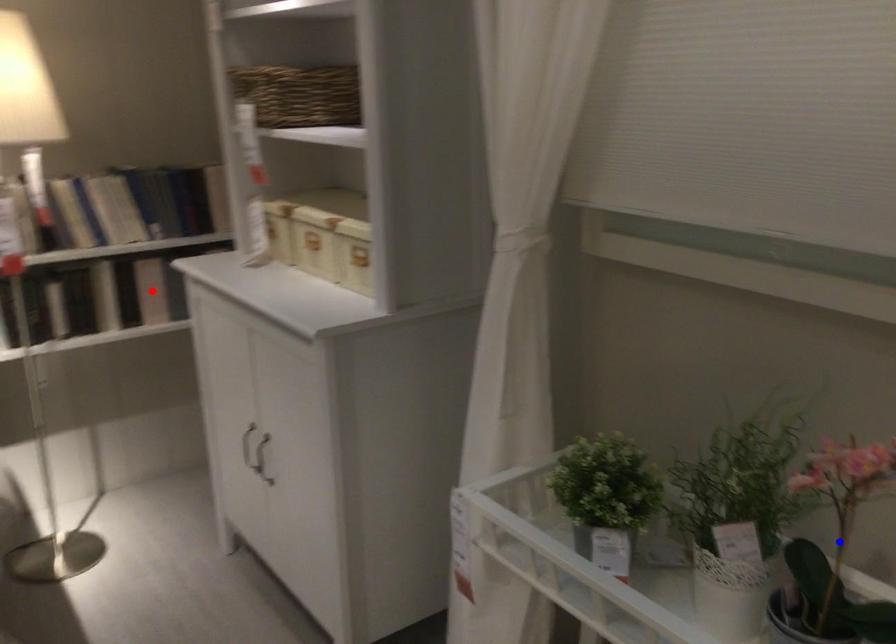
Question: Which of the two points in the image is closer to the camera?

Choices:
 (A) Blue point is closer.
 (B) Red point is closer.

Answer: (A)